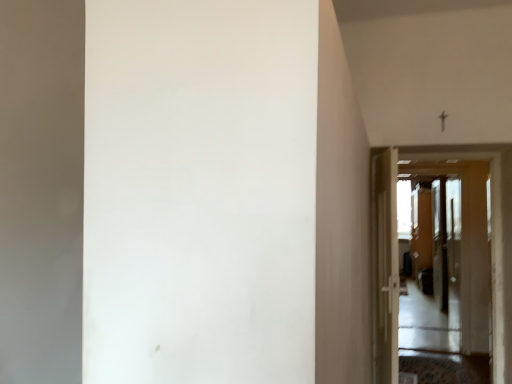
Question: Is white glossy door at center, the second door positioned from the left, far away from white glossy door at right, the 2th door in the right-to-left sequence?

Choices:
 (A) yes
 (B) no

Answer: (A)

Question: From a real-world perspective, is white glossy door at center, the second door positioned from the left, positioned under white glossy door at right, the 2th door in the right-to-left sequence, based on gravity?

Choices:
 (A) no
 (B) yes

Answer: (A)

Question: Is white glossy door at center, the second door positioned from the left, not inside white glossy door at right, the 2th door in the right-to-left sequence?

Choices:
 (A) no
 (B) yes

Answer: (B)

Question: Is white glossy door at right, the 1th door viewed from the left, a part of white glossy door at center, the second door positioned from the left?

Choices:
 (A) no
 (B) yes

Answer: (A)

Question: From the image's perspective, is white glossy door at center, the second door positioned from the left, below white glossy door at right, the 1th door viewed from the left?

Choices:
 (A) no
 (B) yes

Answer: (A)

Question: Is transparent glass screen door at center, the 1th screen door from the left, in front of or behind transparent plastic screen door at right, which is the first screen door from back to front, in the image?

Choices:
 (A) behind
 (B) front

Answer: (B)

Question: Considering the positions of transparent glass screen door at center, the 1th screen door from the left, and transparent plastic screen door at right, acting as the first screen door starting from the right, in the image, is transparent glass screen door at center, the 1th screen door from the left, taller or shorter than transparent plastic screen door at right, acting as the first screen door starting from the right,?

Choices:
 (A) tall
 (B) short

Answer: (A)

Question: Do you think transparent glass screen door at center, positioned as the 2th screen door in back-to-front order, is within transparent plastic screen door at right, which is the second screen door from left to right, or outside of it?

Choices:
 (A) outside
 (B) inside

Answer: (A)

Question: From a real-world perspective, is transparent glass screen door at center, the 1th screen door from the left, above or below transparent plastic screen door at right, which is the second screen door from left to right?

Choices:
 (A) above
 (B) below

Answer: (A)

Question: Considering their positions, is white glossy door at right, the 1th door viewed from the left, located in front of or behind transparent glass screen door at center, which is the 2th screen door from right to left?

Choices:
 (A) front
 (B) behind

Answer: (A)

Question: Is white glossy door at right, the 1th door viewed from the left, bigger or smaller than transparent glass screen door at center, the 1th screen door from the left?

Choices:
 (A) big
 (B) small

Answer: (A)

Question: Considering the positions of point (382, 248) and point (450, 192), is point (382, 248) closer or farther from the camera than point (450, 192)?

Choices:
 (A) farther
 (B) closer

Answer: (B)

Question: Considering the positions of white glossy door at right, the 2th door in the right-to-left sequence, and transparent glass screen door at center, positioned as the 2th screen door in back-to-front order, in the image, is white glossy door at right, the 2th door in the right-to-left sequence, taller or shorter than transparent glass screen door at center, positioned as the 2th screen door in back-to-front order,?

Choices:
 (A) short
 (B) tall

Answer: (A)

Question: In terms of width, does white glossy door at center, marked as the first door in a right-to-left arrangement, look wider or thinner when compared to white glossy door at right, the 2th door in the right-to-left sequence?

Choices:
 (A) thin
 (B) wide

Answer: (A)

Question: From the image's perspective, is white glossy door at center, the second door positioned from the left, located above or below white glossy door at right, the 1th door viewed from the left?

Choices:
 (A) below
 (B) above

Answer: (B)